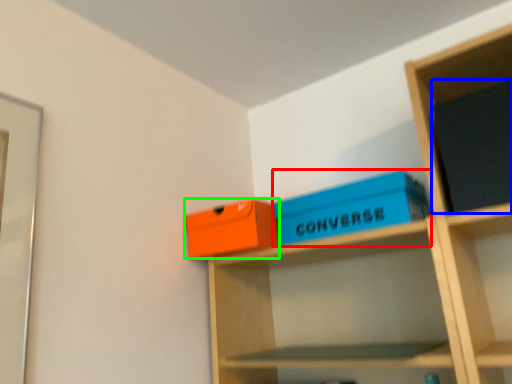
Question: Considering the real-world distances, which object is farthest from box (highlighted by a red box)? paperback book (highlighted by a blue box) or box (highlighted by a green box)?

Choices:
 (A) paperback book
 (B) box

Answer: (A)